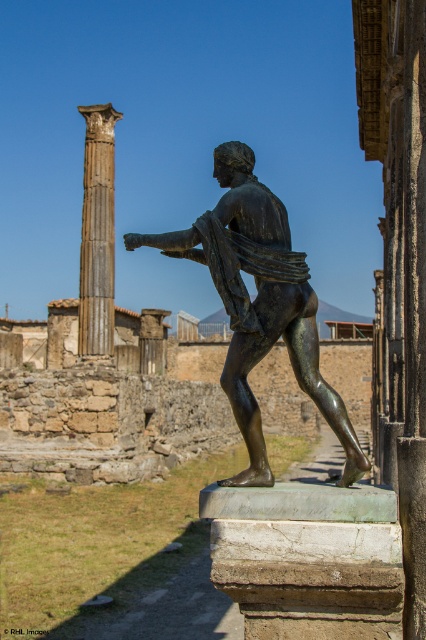
Consider the image. You are an archaeologist examining the ancient Roman site. You notice a point marked at coordinates (259, 304). Based on the scene description, what object does this point most likely correspond to?

The point at coordinates (259, 304) corresponds to the bronze statue at center.